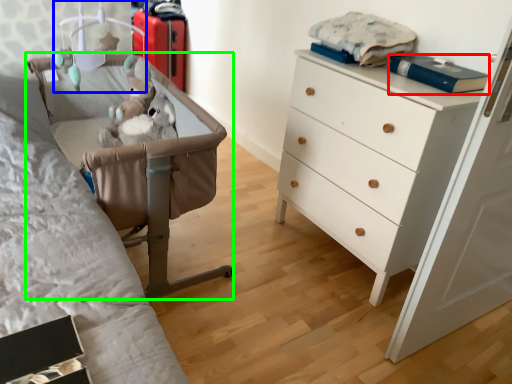
Question: Which is farther away from book (highlighted by a red box)? lamp (highlighted by a blue box) or furniture (highlighted by a green box)?

Choices:
 (A) lamp
 (B) furniture

Answer: (A)